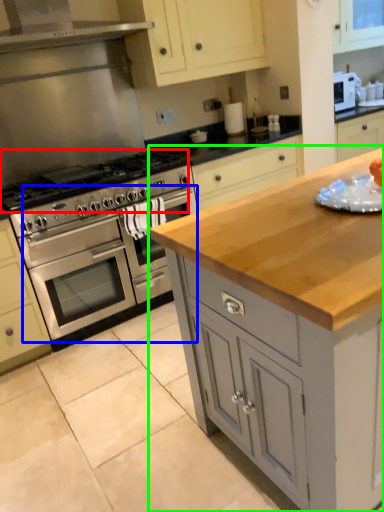
Question: Which object is the closest to the gas stove (highlighted by a red box)? Choose among these: oven (highlighted by a blue box) or cabinetry (highlighted by a green box).

Choices:
 (A) oven
 (B) cabinetry

Answer: (A)